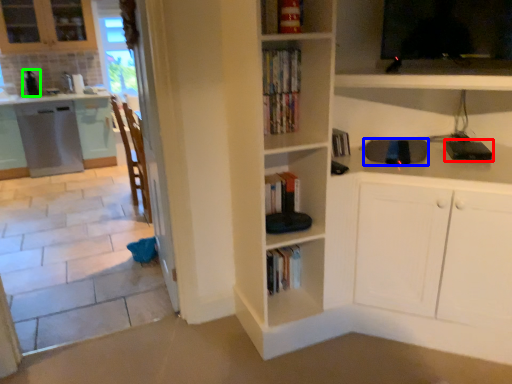
Question: Which object is positioned farthest from appliance (highlighted by a red box)? Select from appliance (highlighted by a blue box) and appliance (highlighted by a green box).

Choices:
 (A) appliance
 (B) appliance

Answer: (B)